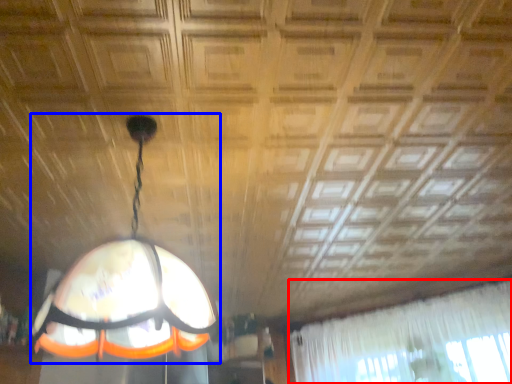
Question: Among these objects, which one is farthest to the camera, curtain (highlighted by a red box) or lamp (highlighted by a blue box)?

Choices:
 (A) curtain
 (B) lamp

Answer: (A)